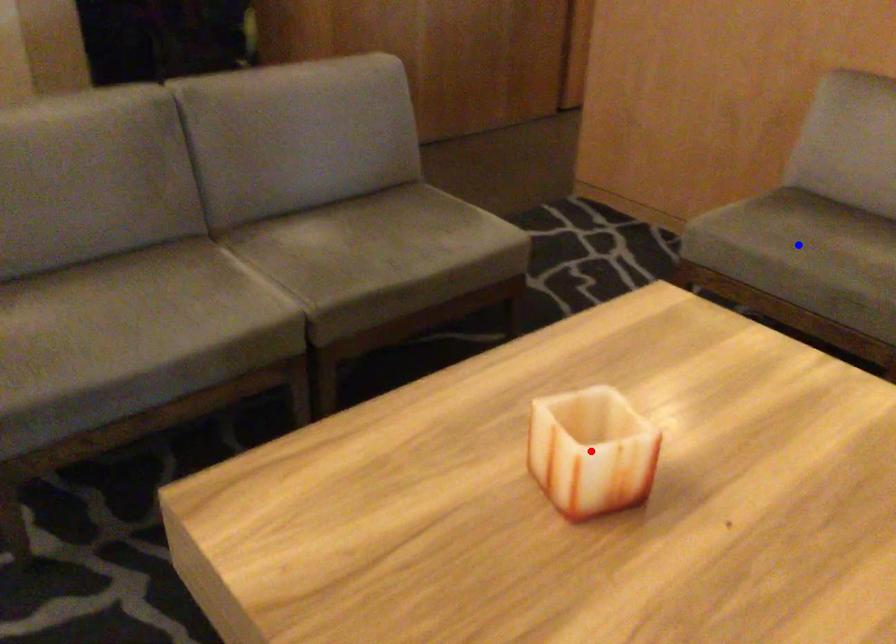
Question: In the image, two points are highlighted. Which point is nearer to the camera? Reply with the corresponding letter.

Choices:
 (A) blue point
 (B) red point

Answer: (B)